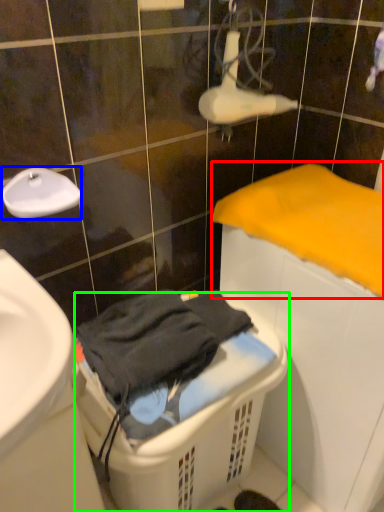
Question: Which is nearer to the bath towel (highlighted by a red box)? faucet (highlighted by a blue box) or laundry basket (highlighted by a green box).

Choices:
 (A) faucet
 (B) laundry basket

Answer: (B)